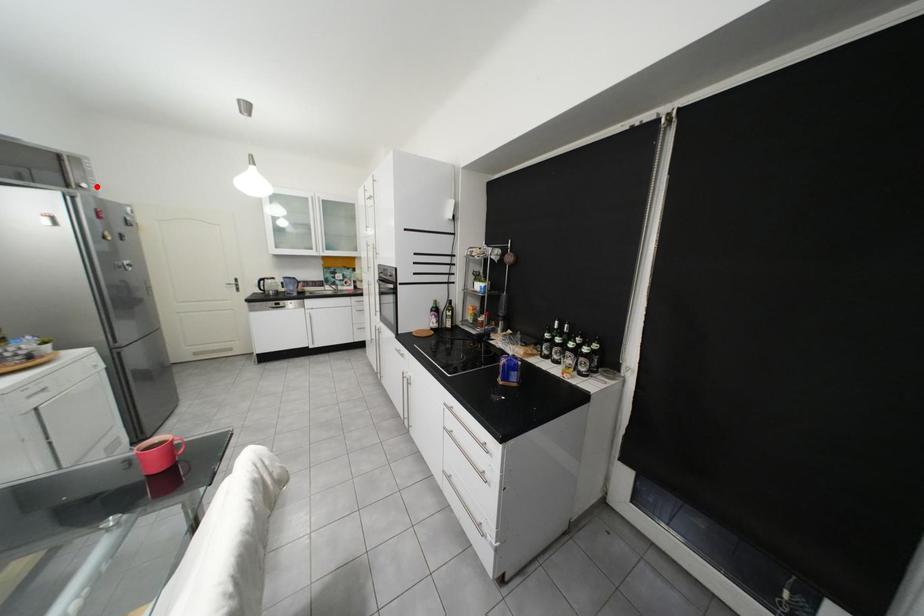
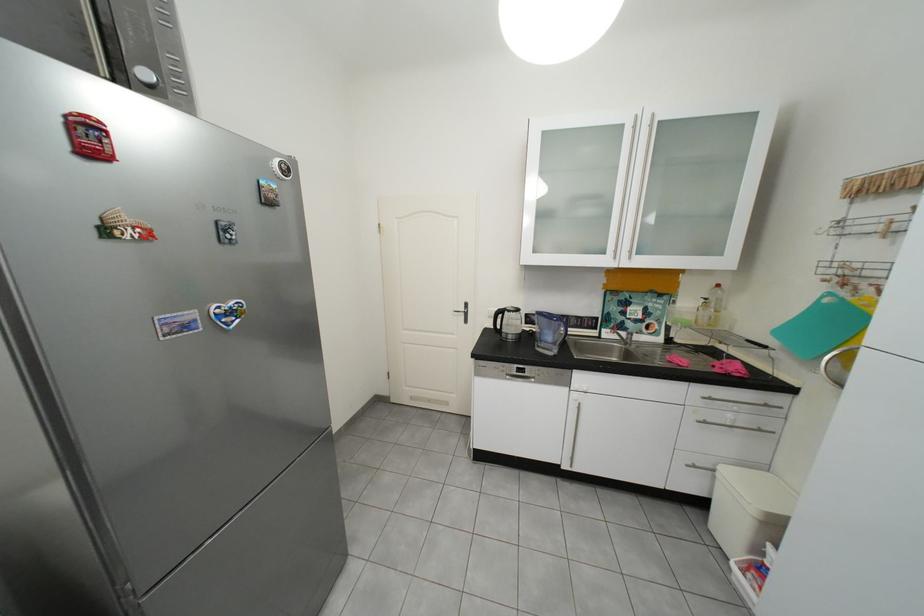
The point at the highlighted location is marked in the first image. Where is the corresponding point in the second image?

(156, 75)